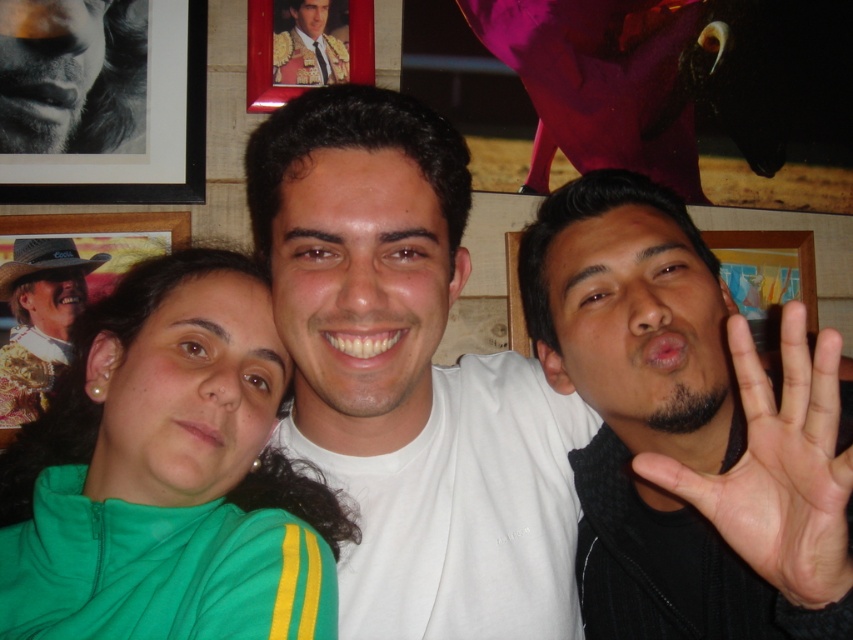
You are a GUI agent. You are given a task and a screenshot of the screen. Output one action in this format:
    pyautogui.click(x=<x>, y=<y>)
    Task: Click on the black matte picture frame at upper left
    
    Given the screenshot: What is the action you would take?
    pos(102,100)

Is point (86, 72) positioned after point (815, 486)?

Yes, point (86, 72) is farther from viewer.

You are a GUI agent. You are given a task and a screenshot of the screen. Output one action in this format:
    pyautogui.click(x=<x>, y=<y>)
    Task: Click on the black matte picture frame at upper left
    The height and width of the screenshot is (640, 853).
    Given the screenshot: What is the action you would take?
    pyautogui.click(x=102, y=100)

Does green fabric at center have a greater width compared to matte black suit at upper center?

Yes, green fabric at center is wider than matte black suit at upper center.

Does green fabric at center have a greater height compared to matte black suit at upper center?

Yes, green fabric at center is taller than matte black suit at upper center.

What do you see at coordinates (164, 481) in the screenshot? I see `green fabric at center` at bounding box center [164, 481].

Locate an element on the screen. This screenshot has width=853, height=640. green fabric at center is located at coordinates (164, 481).

Is green fabric at center thinner than metallic gold picture frame at upper center?

No, green fabric at center is not thinner than metallic gold picture frame at upper center.

Consider the image. Is green fabric at center to the right of metallic gold picture frame at upper center from the viewer's perspective?

No, green fabric at center is not to the right of metallic gold picture frame at upper center.

Does point (291, 605) come farther from viewer compared to point (262, 1)?

No, (291, 605) is in front of (262, 1).

I want to click on green fabric at center, so click(x=164, y=481).